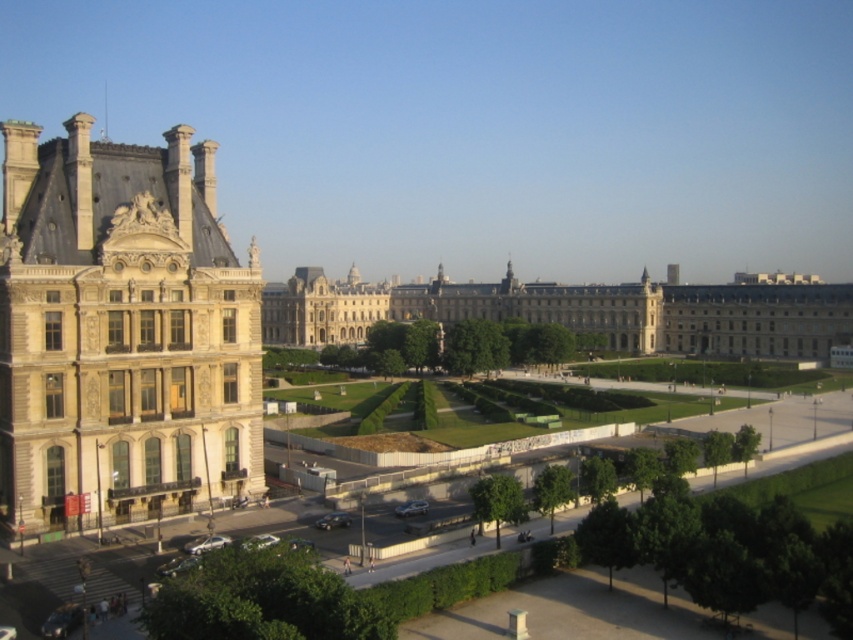
You are standing in the urban landscape and want to take a photo of both the beige stone palace at left and the light beige stone building at center. Since you can only focus on one building at a time, which building should you position yourself closer to in order to capture both in the frame?

To capture both the beige stone palace at left and the light beige stone building at center in the frame, you should position yourself closer to the beige stone palace at left since it is located to the left of the light beige stone building at center, allowing both to be included in the photo.

You are an architect evaluating the urban layout. Based on the scene, which of the two buildings, the beige stone palace at left or the light beige stone building at center, has a more imposing vertical presence?

The beige stone palace at left has a greater height compared to the light beige stone building at center, making it more imposing vertically.

You are an architect analyzing the urban layout of the scene. Which structure takes up more area in the image, the beige stone palace at left or the light beige stone building at center?

The light beige stone building at center occupies more space than the beige stone palace at left according to the description.